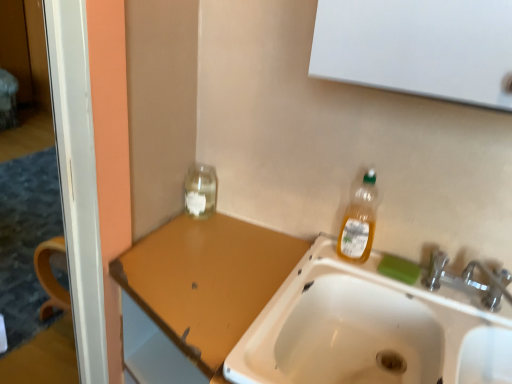
Question: Does transparent glass jar at upper left have a smaller size compared to brown matte counter top at upper left?

Choices:
 (A) no
 (B) yes

Answer: (B)

Question: Is brown matte counter top at upper left inside transparent glass jar at upper left?

Choices:
 (A) yes
 (B) no

Answer: (B)

Question: Is transparent glass jar at upper left to the left of brown matte counter top at upper left from the viewer's perspective?

Choices:
 (A) yes
 (B) no

Answer: (B)

Question: Considering the relative sizes of transparent glass jar at upper left and brown matte counter top at upper left in the image provided, is transparent glass jar at upper left wider than brown matte counter top at upper left?

Choices:
 (A) no
 (B) yes

Answer: (A)

Question: Is transparent glass jar at upper left thinner than brown matte counter top at upper left?

Choices:
 (A) no
 (B) yes

Answer: (B)

Question: Is transparent glass jar at upper left not inside brown matte counter top at upper left?

Choices:
 (A) no
 (B) yes

Answer: (B)

Question: Are translucent plastic bottle at upper right and brown matte counter top at upper left making contact?

Choices:
 (A) yes
 (B) no

Answer: (B)

Question: Is translucent plastic bottle at upper right outside brown matte counter top at upper left?

Choices:
 (A) no
 (B) yes

Answer: (B)

Question: Considering the relative sizes of translucent plastic bottle at upper right and brown matte counter top at upper left in the image provided, is translucent plastic bottle at upper right wider than brown matte counter top at upper left?

Choices:
 (A) yes
 (B) no

Answer: (B)

Question: Is translucent plastic bottle at upper right in front of brown matte counter top at upper left?

Choices:
 (A) no
 (B) yes

Answer: (A)

Question: Does translucent plastic bottle at upper right have a lesser height compared to brown matte counter top at upper left?

Choices:
 (A) yes
 (B) no

Answer: (A)

Question: From a real-world perspective, is translucent plastic bottle at upper right located beneath brown matte counter top at upper left?

Choices:
 (A) yes
 (B) no

Answer: (B)

Question: Is transparent glass jar at upper left wider than green matte bar of soap at sink right?

Choices:
 (A) yes
 (B) no

Answer: (A)